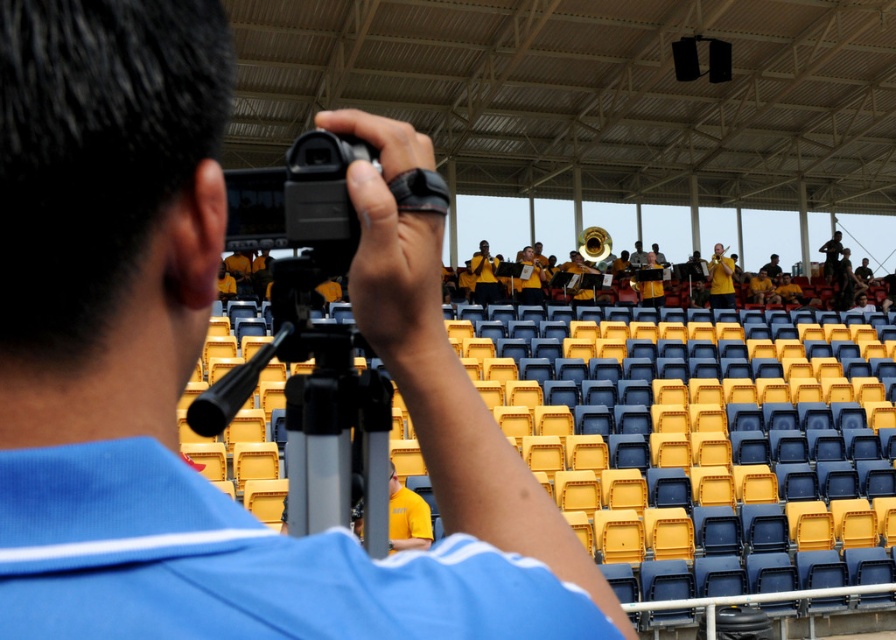
You are setting up equipment for a live stream. You have a black plastic tripod at center and a yellow matte uniform at center. Which object is narrower?

The black plastic tripod at center is narrower than the yellow matte uniform at center.

You are a photographer trying to capture the performance from the front row. You have a black plastic tripod at center and a yellow matte uniform at center in your view. Which object is smaller in size?

The black plastic tripod at center has a smaller size compared to the yellow matte uniform at center.